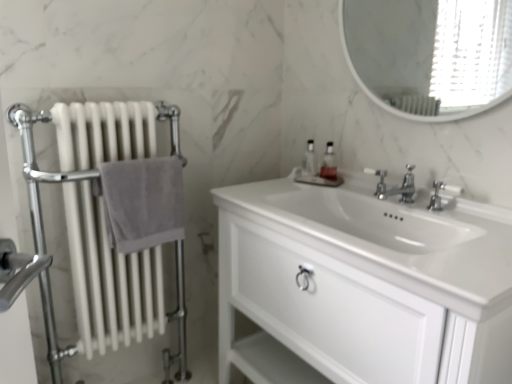
Identify the location of vacant space situated on the left part of polished chrome faucet at center, acting as the second tap starting from the left. (407, 210).